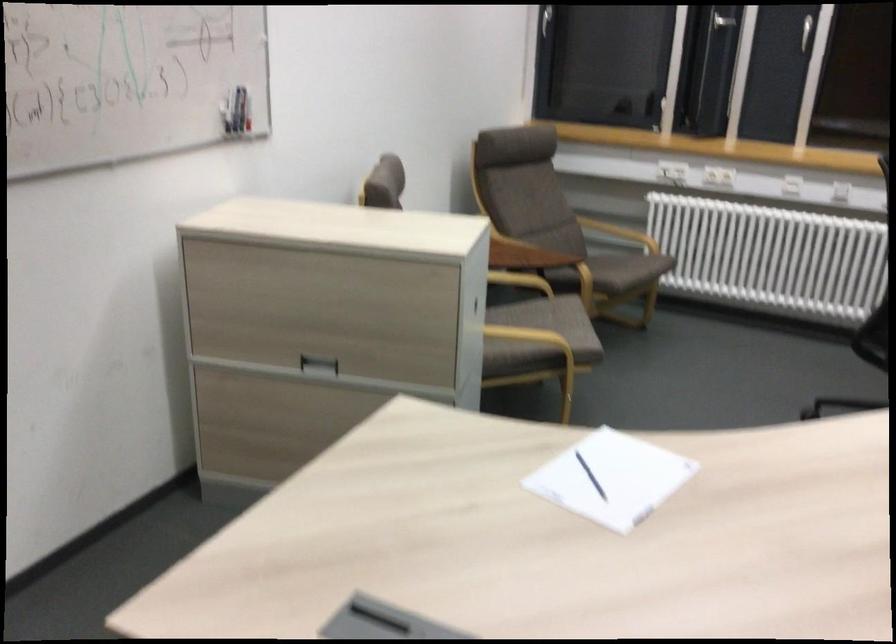
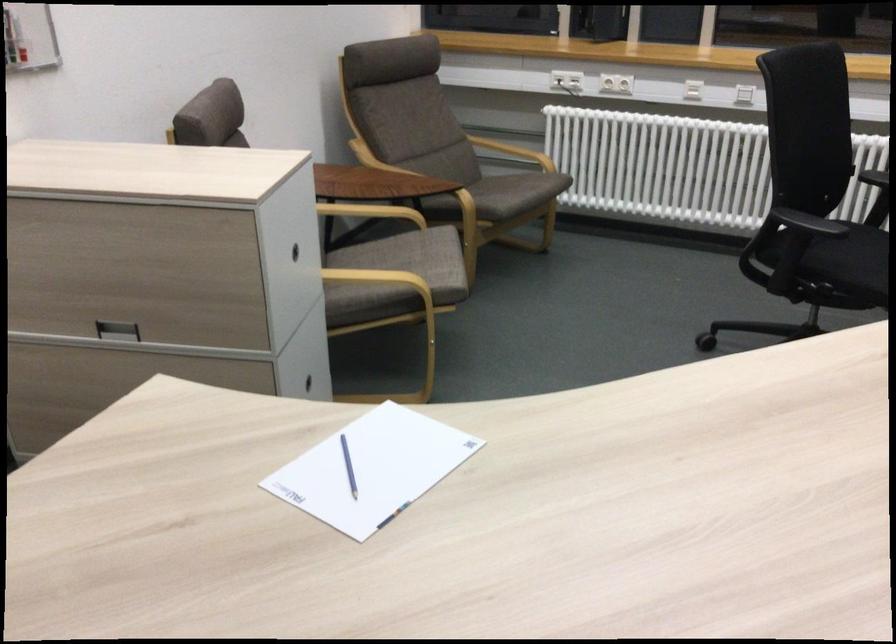
Where in the second image is the point corresponding to (x=579, y=478) from the first image?

(348, 466)